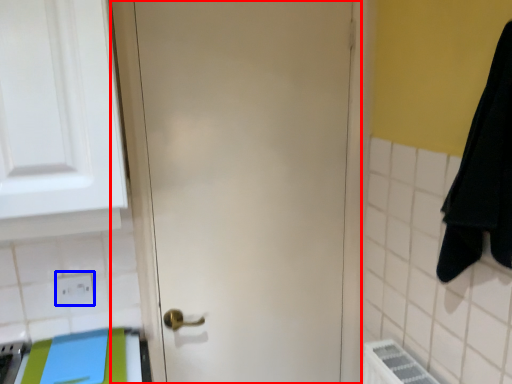
Question: Which point is further to the camera, door (highlighted by a red box) or electric outlet (highlighted by a blue box)?

Choices:
 (A) door
 (B) electric outlet

Answer: (B)